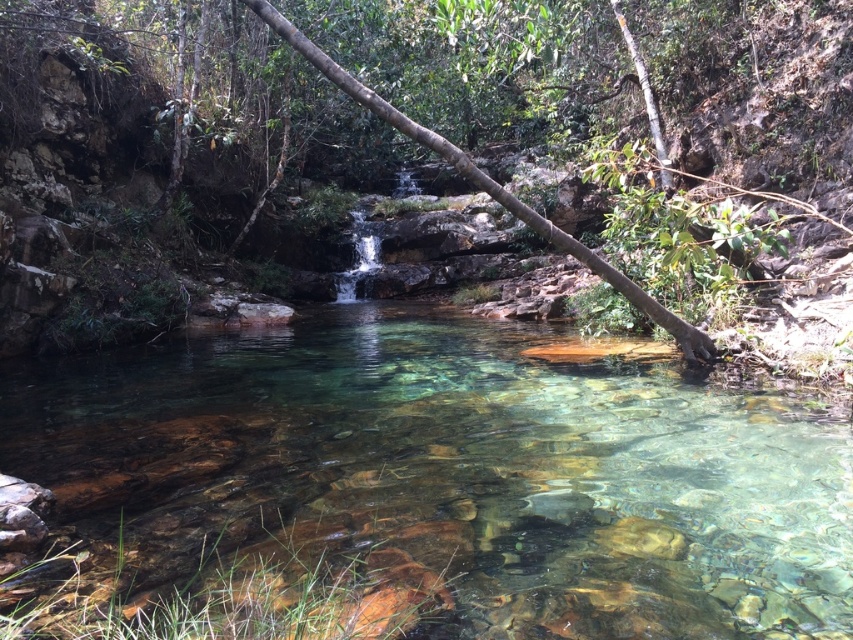
Is clear glassy stream at center below brown wood tree at center?

Yes, clear glassy stream at center is below brown wood tree at center.

Describe the element at coordinates (426, 488) in the screenshot. This screenshot has width=853, height=640. I see `clear glassy stream at center` at that location.

At what (x,y) coordinates should I click in order to perform the action: click on clear glassy stream at center. Please return your answer as a coordinate pair (x, y). Looking at the image, I should click on (426, 488).